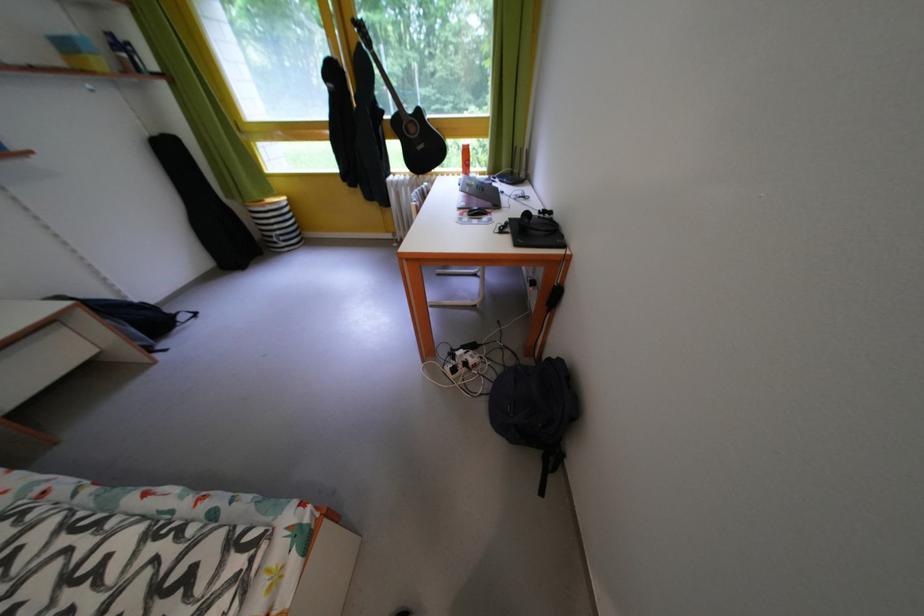
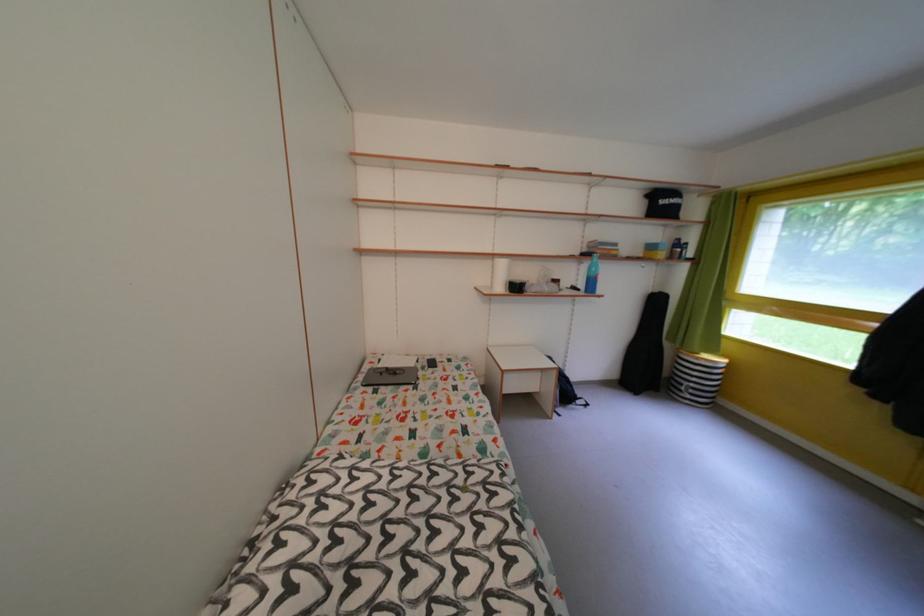
Where in the second image is the point corresponding to point (96, 323) from the first image?

(563, 382)